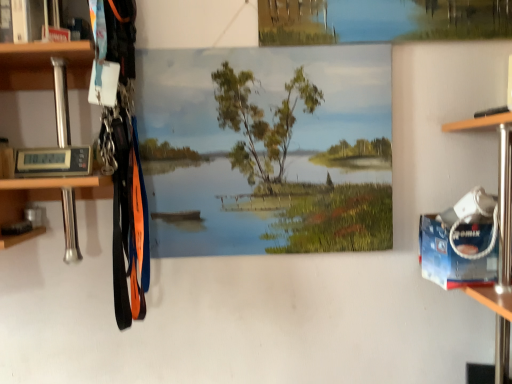
Image resolution: width=512 pixels, height=384 pixels. Describe the element at coordinates (40, 33) in the screenshot. I see `brushed metal cabinet at upper left` at that location.

You are a GUI agent. You are given a task and a screenshot of the screen. Output one action in this format:
    pyautogui.click(x=<x>, y=<y>)
    Task: Click on the brushed metal cabinet at upper left
    
    Given the screenshot: What is the action you would take?
    pyautogui.click(x=40, y=33)

What do you see at coordinates (267, 149) in the screenshot? I see `smooth canvas landscape at center` at bounding box center [267, 149].

Where is `smooth canvas landscape at center`? This screenshot has width=512, height=384. smooth canvas landscape at center is located at coordinates (267, 149).

What is the approximate height of smooth canvas landscape at center?

The height of smooth canvas landscape at center is 20.40 inches.

Measure the distance between smooth canvas landscape at center and camera.

smooth canvas landscape at center is 1.00 meters away from camera.

The width and height of the screenshot is (512, 384). I want to click on brushed metal cabinet at upper left, so click(x=40, y=33).

Would you say smooth canvas landscape at center is to the left or to the right of brushed metal cabinet at upper left in the picture?

Based on their positions, smooth canvas landscape at center is located to the right of brushed metal cabinet at upper left.

Is smooth canvas landscape at center in front of or behind brushed metal cabinet at upper left in the image?

smooth canvas landscape at center is behind brushed metal cabinet at upper left.

Considering the points (315, 53) and (11, 16), which point is behind, point (315, 53) or point (11, 16)?

The point (315, 53) is farther from the camera.

From the image's perspective, is smooth canvas landscape at center above or below brushed metal cabinet at upper left?

Clearly, from the image's perspective, smooth canvas landscape at center is below brushed metal cabinet at upper left.

From a real-world perspective, is smooth canvas landscape at center located higher than brushed metal cabinet at upper left?

No, from a real-world perspective, smooth canvas landscape at center is not on top of brushed metal cabinet at upper left.

Which of these two, smooth canvas landscape at center or brushed metal cabinet at upper left, is thinner?

smooth canvas landscape at center is thinner.

Can you confirm if smooth canvas landscape at center is shorter than brushed metal cabinet at upper left?

No, smooth canvas landscape at center is not shorter than brushed metal cabinet at upper left.

Who is bigger, smooth canvas landscape at center or brushed metal cabinet at upper left?

smooth canvas landscape at center is bigger.

Is smooth canvas landscape at center situated inside brushed metal cabinet at upper left or outside?

smooth canvas landscape at center is located beyond the bounds of brushed metal cabinet at upper left.

Is smooth canvas landscape at center next to brushed metal cabinet at upper left?

No, smooth canvas landscape at center is not with brushed metal cabinet at upper left.

Is smooth canvas landscape at center facing towards brushed metal cabinet at upper left?

No, smooth canvas landscape at center does not turn towards brushed metal cabinet at upper left.

The width and height of the screenshot is (512, 384). Find the location of `cabinet on the left of smooth canvas landscape at center`. cabinet on the left of smooth canvas landscape at center is located at coordinates (40, 33).

Which object is positioned more to the left, brushed metal cabinet at upper left or smooth canvas landscape at center?

From the viewer's perspective, brushed metal cabinet at upper left appears more on the left side.

Is brushed metal cabinet at upper left in front of smooth canvas landscape at center?

That is True.

Considering the points (57, 54) and (271, 63), which point is behind, point (57, 54) or point (271, 63)?

The point (271, 63) is behind.

From the image's perspective, is brushed metal cabinet at upper left located above or below smooth canvas landscape at center?

Based on their image positions, brushed metal cabinet at upper left is located above smooth canvas landscape at center.

From a real-world perspective, does brushed metal cabinet at upper left stand above smooth canvas landscape at center?

Yes, from a real-world perspective, brushed metal cabinet at upper left is over smooth canvas landscape at center

Between brushed metal cabinet at upper left and smooth canvas landscape at center, which one has larger width?

With larger width is brushed metal cabinet at upper left.

Between brushed metal cabinet at upper left and smooth canvas landscape at center, which one has less height?

With less height is brushed metal cabinet at upper left.

Considering the sizes of objects brushed metal cabinet at upper left and smooth canvas landscape at center in the image provided, who is smaller, brushed metal cabinet at upper left or smooth canvas landscape at center?

Smaller between the two is brushed metal cabinet at upper left.

Is brushed metal cabinet at upper left positioned beyond the bounds of smooth canvas landscape at center?

That's correct, brushed metal cabinet at upper left is outside of smooth canvas landscape at center.

Can you see brushed metal cabinet at upper left touching smooth canvas landscape at center?

No, brushed metal cabinet at upper left is not beside smooth canvas landscape at center.

Is brushed metal cabinet at upper left positioned with its back to smooth canvas landscape at center?

brushed metal cabinet at upper left is not turned away from smooth canvas landscape at center.

What's the angular difference between brushed metal cabinet at upper left and smooth canvas landscape at center's facing directions?

The angle between the facing direction of brushed metal cabinet at upper left and the facing direction of smooth canvas landscape at center is 0.952 degrees.

In the image, there is a brushed metal cabinet at upper left. At what (x,y) coordinates should I click in order to perform the action: click on oil painting below it (from the image's perspective). Please return your answer as a coordinate pair (x, y). This screenshot has height=384, width=512. Looking at the image, I should click on (267, 149).

Find the location of `cabinet lying above the smooth canvas landscape at center (from the image's perspective)`. cabinet lying above the smooth canvas landscape at center (from the image's perspective) is located at coordinates (40, 33).

This screenshot has width=512, height=384. Identify the location of cabinet that appears above the smooth canvas landscape at center (from a real-world perspective). (40, 33).